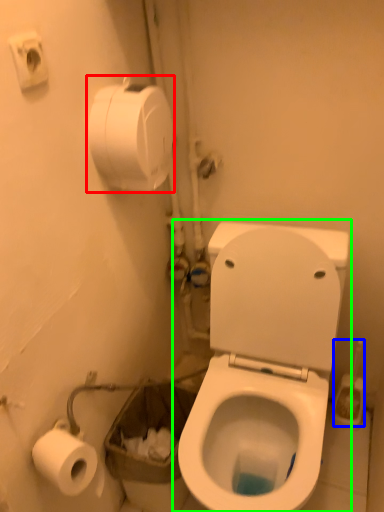
Question: Which object is the farthest from toilet paper (highlighted by a red box)? Choose among these: brush (highlighted by a blue box) or toilet (highlighted by a green box).

Choices:
 (A) brush
 (B) toilet

Answer: (A)